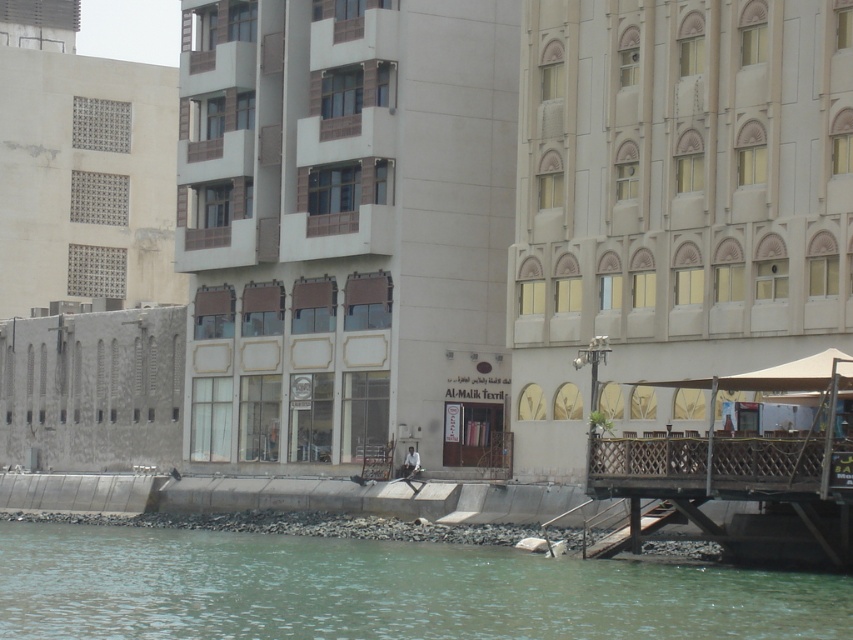
Question: Based on their relative distances, which object is farther from the beige concrete building at center?

Choices:
 (A) beige stone building at center
 (B) brown wooden dock at lower right
 (C) greenish water at lower left

Answer: (B)

Question: Among these points, which one is nearest to the camera?

Choices:
 (A) (602, 552)
 (B) (732, 285)
 (C) (816, 595)

Answer: (C)

Question: Does beige stone building at center have a larger size compared to brown wooden dock at lower right?

Choices:
 (A) yes
 (B) no

Answer: (A)

Question: Which point appears farthest from the camera in this image?

Choices:
 (A) (401, 326)
 (B) (834, 385)

Answer: (A)

Question: Can you confirm if beige stone building at center is smaller than greenish water at lower left?

Choices:
 (A) yes
 (B) no

Answer: (A)

Question: Is beige concrete building at center further to the viewer compared to brown wooden dock at lower right?

Choices:
 (A) no
 (B) yes

Answer: (B)